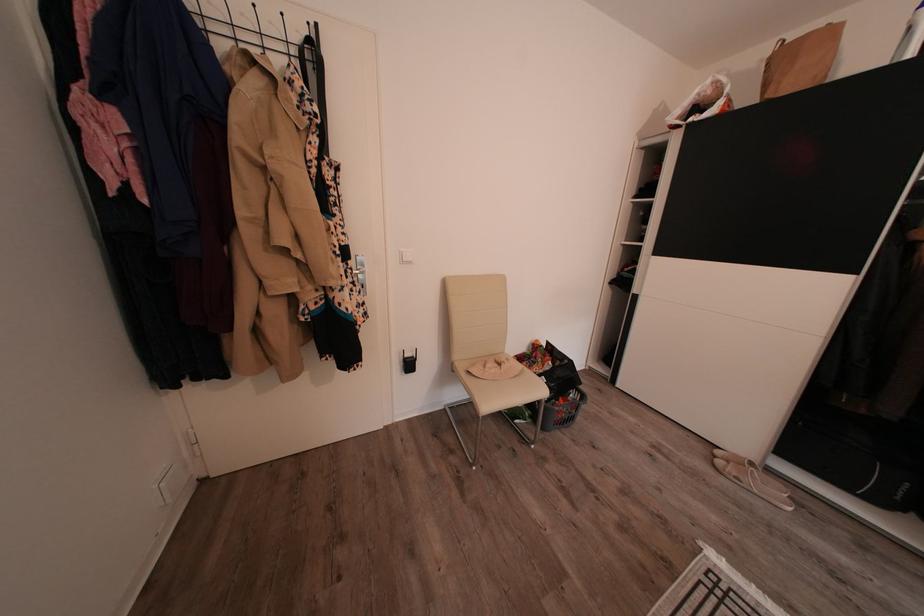
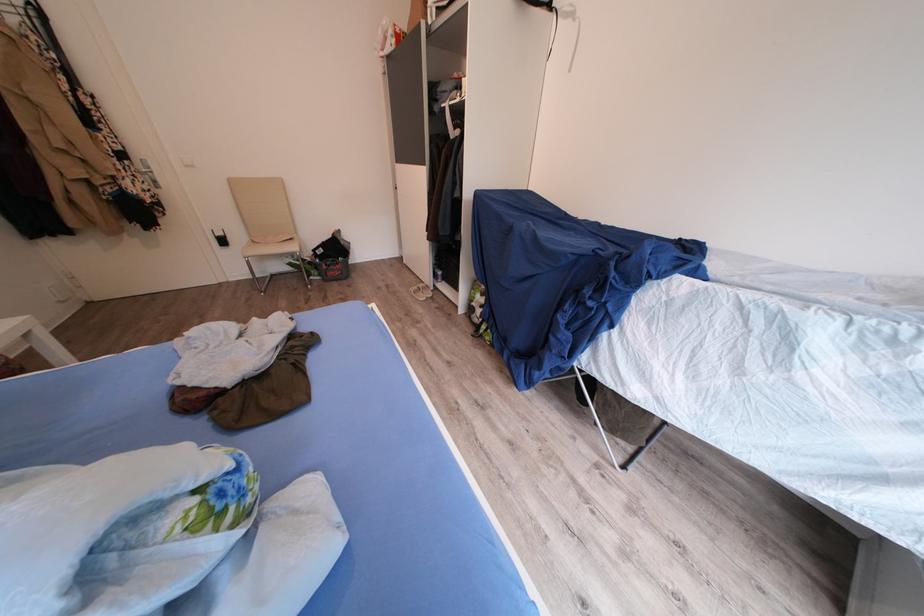
From the picture: What movement of the cameraman would produce the second image?

The cameraman moved toward right, backward.